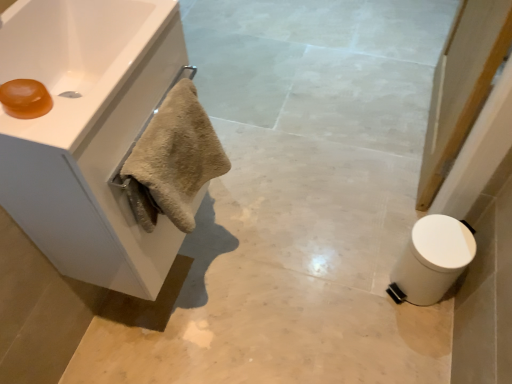
Question: From their relative heights in the image, would you say beige fluffy towel at left is taller or shorter than white glossy sink at upper left?

Choices:
 (A) short
 (B) tall

Answer: (B)

Question: Based on their positions, is beige fluffy towel at left located to the left or right of white glossy sink at upper left?

Choices:
 (A) right
 (B) left

Answer: (A)

Question: Which object is the closest to the white matte trash can at lower right?

Choices:
 (A) white matte cabinet at upper left
 (B) beige fluffy towel at left
 (C) white marble towel at left
 (D) white glossy sink at upper left
 (E) translucent amber soap at upper left

Answer: (C)

Question: Considering the real-world distances, which object is farthest from the translucent amber soap at upper left?

Choices:
 (A) white marble towel at left
 (B) white matte cabinet at upper left
 (C) white glossy sink at upper left
 (D) beige fluffy towel at left
 (E) white matte trash can at lower right

Answer: (E)